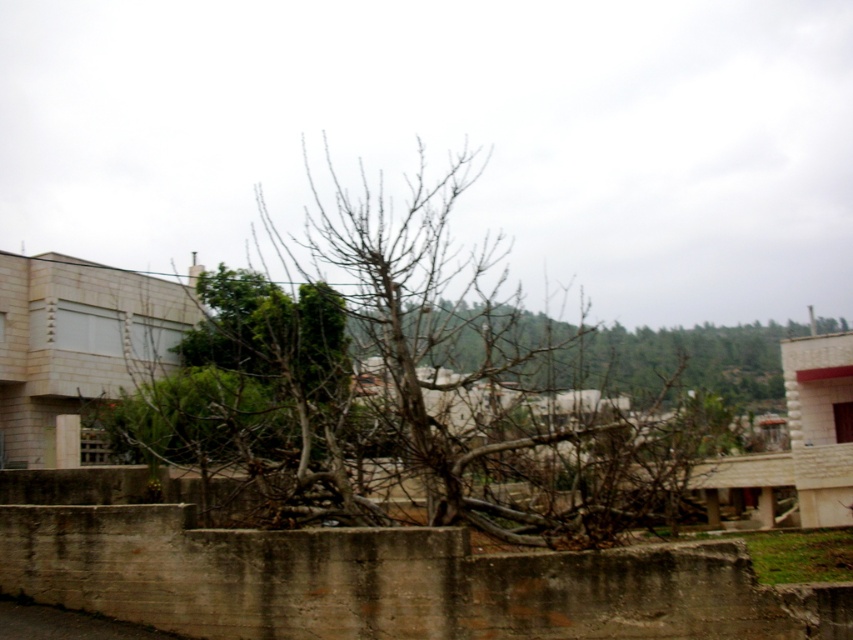
Is point (363, 212) farther from viewer compared to point (711, 376)?

No, (363, 212) is in front of (711, 376).

Which of these two, brown/dry wood tree at center or bare branches at center, stands taller?

Standing taller between the two is brown/dry wood tree at center.

At what (x,y) coordinates should I click in order to perform the action: click on brown/dry wood tree at center. Please return your answer as a coordinate pair (x, y). The image size is (853, 640). Looking at the image, I should click on (409, 388).